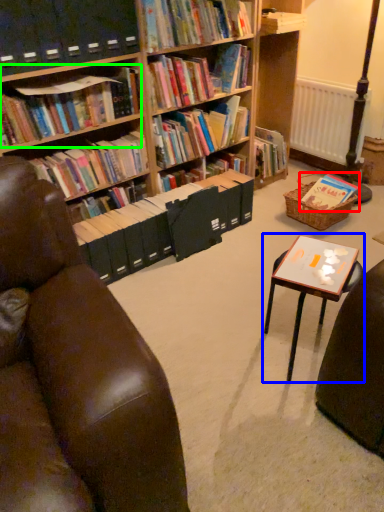
Question: Estimate the real-world distances between objects in this image. Which object is farther from book (highlighted by a red box), table (highlighted by a blue box) or book (highlighted by a green box)?

Choices:
 (A) table
 (B) book

Answer: (B)